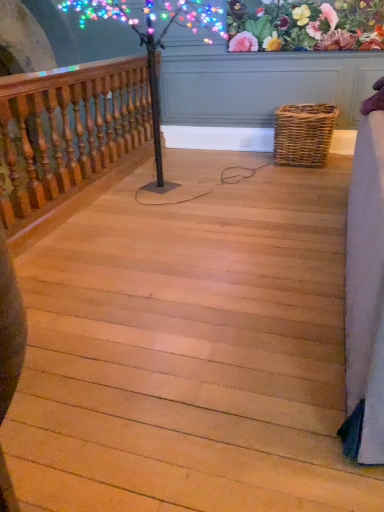
Question: Is floral fabric at upper center thinner than wooden baluster at left?

Choices:
 (A) no
 (B) yes

Answer: (B)

Question: Is floral fabric at upper center wider than wooden baluster at left?

Choices:
 (A) no
 (B) yes

Answer: (A)

Question: Is floral fabric at upper center at the right side of wooden baluster at left?

Choices:
 (A) no
 (B) yes

Answer: (B)

Question: Is floral fabric at upper center oriented away from wooden baluster at left?

Choices:
 (A) no
 (B) yes

Answer: (A)

Question: Is floral fabric at upper center further to camera compared to wooden baluster at left?

Choices:
 (A) no
 (B) yes

Answer: (B)

Question: From the image's perspective, relative to woven brown picnic basket at lower right, is light wood stairs at center above or below?

Choices:
 (A) below
 (B) above

Answer: (A)

Question: Is light wood stairs at center bigger or smaller than woven brown picnic basket at lower right?

Choices:
 (A) big
 (B) small

Answer: (A)

Question: From their relative heights in the image, would you say light wood stairs at center is taller or shorter than woven brown picnic basket at lower right?

Choices:
 (A) short
 (B) tall

Answer: (A)

Question: In the image, is light wood stairs at center on the left side or the right side of woven brown picnic basket at lower right?

Choices:
 (A) right
 (B) left

Answer: (B)

Question: In the image, is light wood stairs at center positioned in front of or behind wooden baluster at left?

Choices:
 (A) front
 (B) behind

Answer: (A)

Question: From a real-world perspective, is light wood stairs at center physically located above or below wooden baluster at left?

Choices:
 (A) below
 (B) above

Answer: (A)

Question: Visually, is light wood stairs at center positioned to the left or to the right of wooden baluster at left?

Choices:
 (A) left
 (B) right

Answer: (B)

Question: Does point (332, 412) appear closer or farther from the camera than point (97, 77)?

Choices:
 (A) farther
 (B) closer

Answer: (B)

Question: Is woven brown picnic basket at lower right taller or shorter than light wood stairs at center?

Choices:
 (A) short
 (B) tall

Answer: (B)

Question: In the image, is woven brown picnic basket at lower right positioned in front of or behind light wood stairs at center?

Choices:
 (A) front
 (B) behind

Answer: (B)